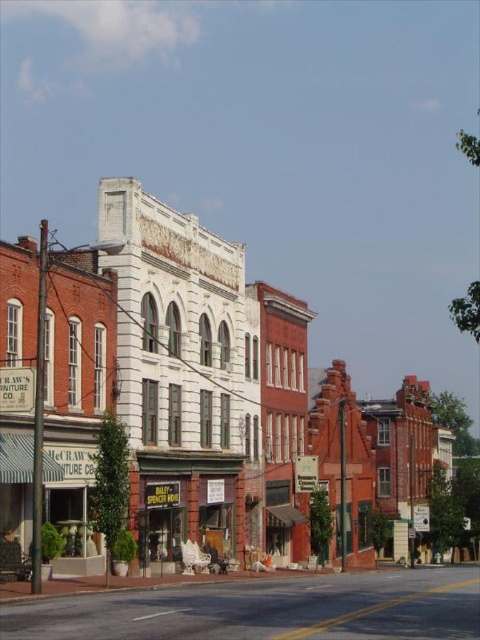
You are a delivery driver who needs to park your truck between the white brick building at center and the matte brown storefront at center. Given that your truck is 10 meters long, can you fit it in the space between them?

The white brick building at center is wider than the matte brown storefront at center, but the description does not provide specific measurements of the space between them. Therefore, it is impossible to determine if the truck will fit based on the given information.

You are a delivery person trying to reach the matte brown storefront at center. There is a white brick building at center blocking your path. Can you go around it to the left or right? Please explain based on the scene description.

The white brick building at center is in front of the matte brown storefront at center, so you can go around to either side of the white brick building at center to reach the matte brown storefront at center.

You are standing on the street and want to enter the matte brown storefront at center. Which direction should you walk relative to the white brick building at center?

You should walk downward relative to the white brick building at center since the white brick building at center is located above the matte brown storefront at center.